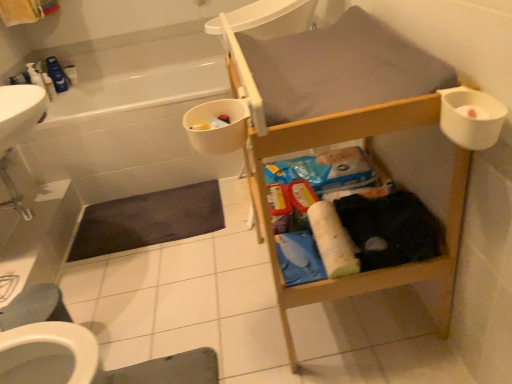
Find the location of a particular element. The height and width of the screenshot is (384, 512). free space in front of dark matte bath mat at lower left, which appears as the second bath mat when ordered from the bottom is located at coordinates (157, 280).